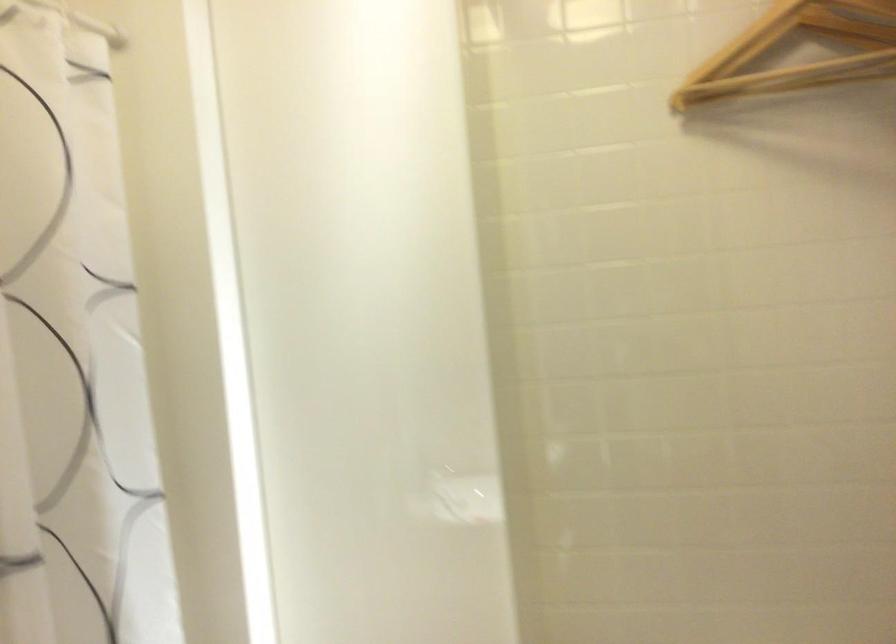
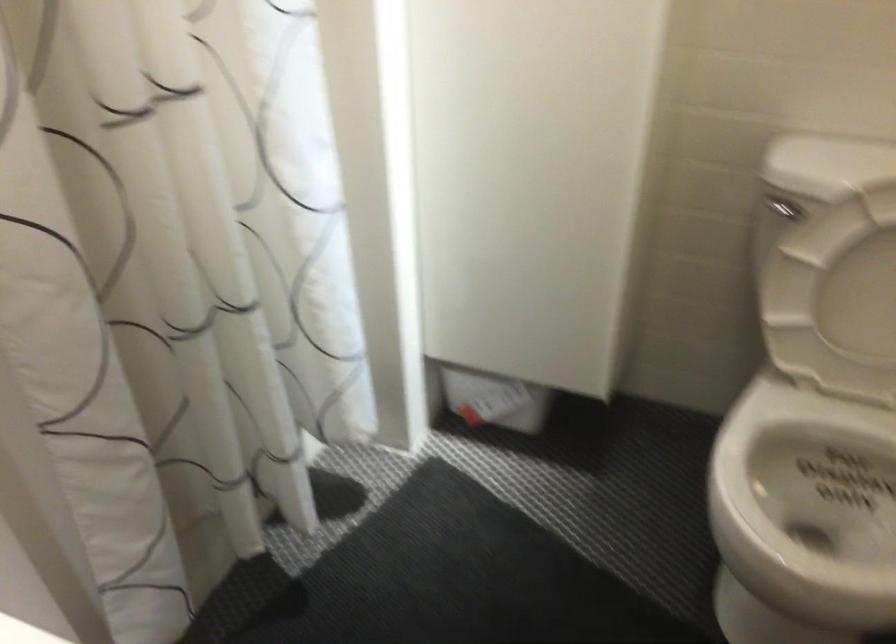
Question: The images are taken continuously from a first-person perspective. In which direction is your viewpoint rotating?

Choices:
 (A) Left
 (B) Right
 (C) Up
 (D) Down

Answer: (D)